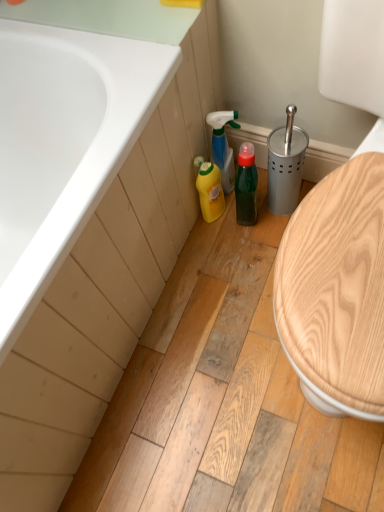
Where is `free space in front of green matte bottle at center`? free space in front of green matte bottle at center is located at coordinates (251, 260).